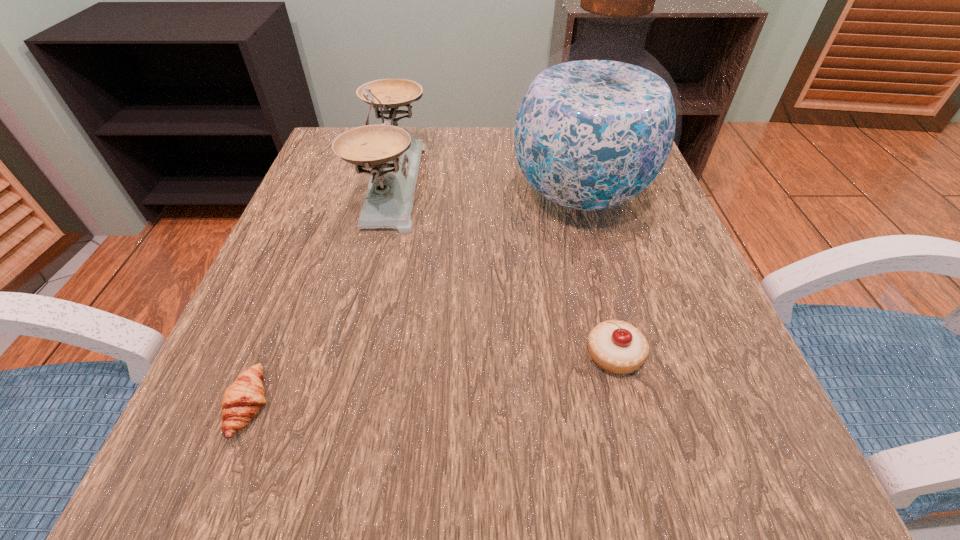
Identify the location of water jug. Image resolution: width=960 pixels, height=540 pixels. (595, 127).

At what (x,y) coordinates should I click in order to perform the action: click on the third object from right to left. Please return your answer as a coordinate pair (x, y). Looking at the image, I should click on (394, 155).

At what (x,y) coordinates should I click in order to perform the action: click on the second tallest object. Please return your answer as a coordinate pair (x, y). This screenshot has height=540, width=960. Looking at the image, I should click on (394, 155).

The width and height of the screenshot is (960, 540). I want to click on the right pastry, so click(617, 347).

The height and width of the screenshot is (540, 960). What are the coordinates of `the taller pastry` in the screenshot? It's located at (617, 347).

Where is `the leftmost object`? Image resolution: width=960 pixels, height=540 pixels. the leftmost object is located at coordinates (241, 402).

Where is `the left pastry`? This screenshot has width=960, height=540. the left pastry is located at coordinates (241, 402).

Where is `vacant area situated 0.090m on the left of the tallest object`? The width and height of the screenshot is (960, 540). vacant area situated 0.090m on the left of the tallest object is located at coordinates (463, 195).

Locate an element on the screen. free space located 0.210m on the front-facing side of the second tallest object is located at coordinates (524, 184).

At what (x,y) coordinates should I click in order to perform the action: click on free space located on the left of the taller pastry. Please return your answer as a coordinate pair (x, y). The image size is (960, 540). Looking at the image, I should click on point(420,355).